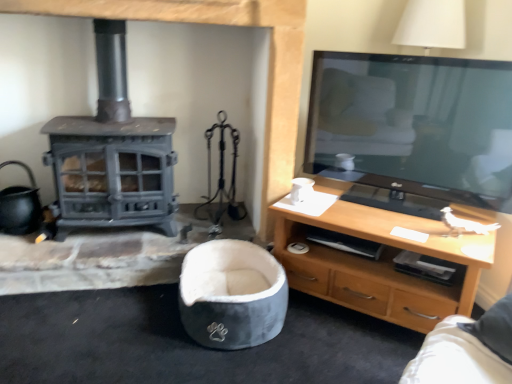
What is the approximate height of velvet grey bean bag chair at center?

10.22 inches.

Locate an element on the screen. The height and width of the screenshot is (384, 512). velvet grey bean bag chair at center is located at coordinates (232, 294).

Describe the element at coordinates (232, 294) in the screenshot. I see `velvet grey bean bag chair at center` at that location.

Measure the distance between point [234,319] and camera.

The distance of point [234,319] from camera is 5.50 feet.

The width and height of the screenshot is (512, 384). What are the coordinates of `light wood/finish tv stand at right` in the screenshot? It's located at [x=378, y=265].

What is the approximate width of light wood/finish tv stand at right?

light wood/finish tv stand at right is 56.15 centimeters wide.

In order to face light wood/finish tv stand at right, should I rotate leftwards or rightwards?

Turn right approximately 15.852 degrees to face it.

The width and height of the screenshot is (512, 384). What do you see at coordinates (378, 265) in the screenshot?
I see `light wood/finish tv stand at right` at bounding box center [378, 265].

Locate an element on the screen. This screenshot has width=512, height=384. velvet grey bean bag chair at center is located at coordinates (232, 294).

Is velvet grey bean bag chair at center to the right of light wood/finish tv stand at right from the viewer's perspective?

No.

Is velvet grey bean bag chair at center positioned behind light wood/finish tv stand at right?

Yes, velvet grey bean bag chair at center is further from the camera.

Is point (217, 257) in front of point (380, 209)?

That is False.

From the image's perspective, would you say velvet grey bean bag chair at center is shown under light wood/finish tv stand at right?

Yes, from the image's perspective, velvet grey bean bag chair at center is below light wood/finish tv stand at right.

From a real-world perspective, which is physically below, velvet grey bean bag chair at center or light wood/finish tv stand at right?

velvet grey bean bag chair at center.

Which of these two, velvet grey bean bag chair at center or light wood/finish tv stand at right, is thinner?

velvet grey bean bag chair at center.

From their relative heights in the image, would you say velvet grey bean bag chair at center is taller or shorter than light wood/finish tv stand at right?

Clearly, velvet grey bean bag chair at center is shorter compared to light wood/finish tv stand at right.

Between velvet grey bean bag chair at center and light wood/finish tv stand at right, which one has larger size?

light wood/finish tv stand at right is bigger.

Is velvet grey bean bag chair at center inside or outside of light wood/finish tv stand at right?

velvet grey bean bag chair at center cannot be found inside light wood/finish tv stand at right.

Is velvet grey bean bag chair at center directly adjacent to light wood/finish tv stand at right?

No, velvet grey bean bag chair at center is not with light wood/finish tv stand at right.

Does velvet grey bean bag chair at center turn towards light wood/finish tv stand at right?

No, velvet grey bean bag chair at center is not oriented towards light wood/finish tv stand at right.

Measure the distance from velvet grey bean bag chair at center to light wood/finish tv stand at right.

velvet grey bean bag chair at center and light wood/finish tv stand at right are 15.41 inches apart.

In order to click on bean bag chair that is below the light wood/finish tv stand at right (from the image's perspective) in this screenshot , I will do `click(232, 294)`.

Visually, is light wood/finish tv stand at right positioned to the left or to the right of velvet grey bean bag chair at center?

light wood/finish tv stand at right is positioned on velvet grey bean bag chair at center's right side.

Is light wood/finish tv stand at right positioned in front of velvet grey bean bag chair at center?

Yes, it is.

Which is closer, (409, 249) or (216, 247)?

Clearly, point (409, 249) is closer to the camera than point (216, 247).

From the image's perspective, is light wood/finish tv stand at right below velvet grey bean bag chair at center?

No, from the image's perspective, light wood/finish tv stand at right is not below velvet grey bean bag chair at center.

From a real-world perspective, is light wood/finish tv stand at right over velvet grey bean bag chair at center?

Indeed, from a real-world perspective, light wood/finish tv stand at right stands above velvet grey bean bag chair at center.

Considering the relative sizes of light wood/finish tv stand at right and velvet grey bean bag chair at center in the image provided, is light wood/finish tv stand at right thinner than velvet grey bean bag chair at center?

In fact, light wood/finish tv stand at right might be wider than velvet grey bean bag chair at center.

Between light wood/finish tv stand at right and velvet grey bean bag chair at center, which one has more height?

Standing taller between the two is light wood/finish tv stand at right.

Considering the relative sizes of light wood/finish tv stand at right and velvet grey bean bag chair at center in the image provided, is light wood/finish tv stand at right bigger than velvet grey bean bag chair at center?

Yes.

Choose the correct answer: Is light wood/finish tv stand at right inside velvet grey bean bag chair at center or outside it?

The correct answer is: outside.

Is light wood/finish tv stand at right placed right next to velvet grey bean bag chair at center?

They are not placed beside each other.

Is light wood/finish tv stand at right turned away from velvet grey bean bag chair at center?

No.

How different are the orientations of light wood/finish tv stand at right and velvet grey bean bag chair at center in degrees?

The angle between the facing direction of light wood/finish tv stand at right and the facing direction of velvet grey bean bag chair at center is 40.4 degrees.

In the image, there is a velvet grey bean bag chair at center. In order to click on desk above it (from the image's perspective) in this screenshot , I will do `click(378, 265)`.

Identify the location of desk above the velvet grey bean bag chair at center (from a real-world perspective). (378, 265).

The height and width of the screenshot is (384, 512). Find the location of `desk lying on the right of velvet grey bean bag chair at center`. desk lying on the right of velvet grey bean bag chair at center is located at coordinates (378, 265).